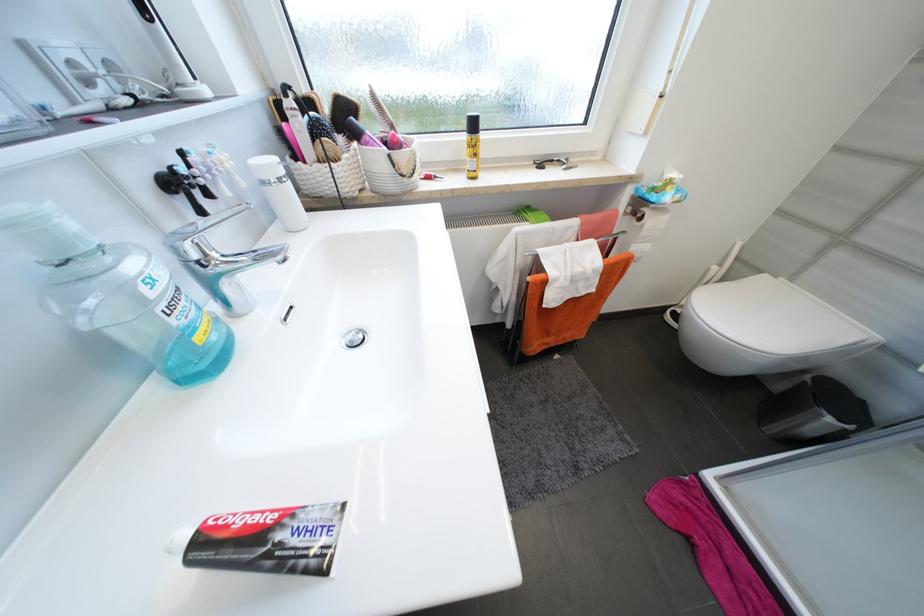
Where would you lift the white toilet lid? Please return your answer as a coordinate pair (x, y).

(766, 329)